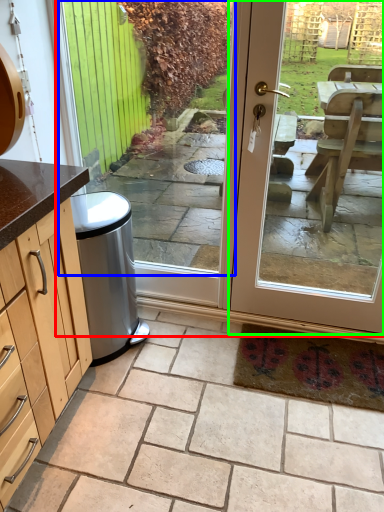
Question: Which object is positioned farthest from screen door (highlighted by a red box)? Select from window (highlighted by a blue box) and door (highlighted by a green box).

Choices:
 (A) window
 (B) door

Answer: (A)